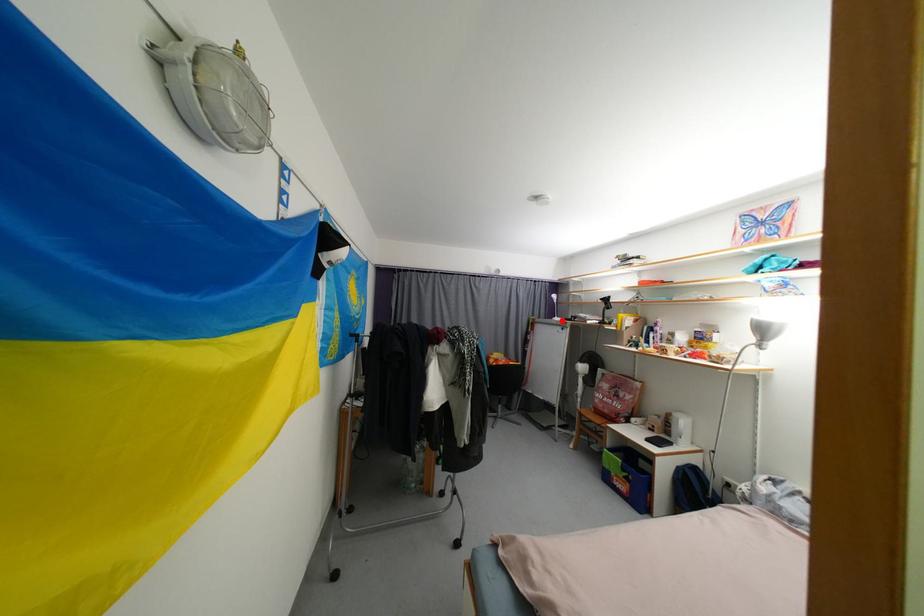
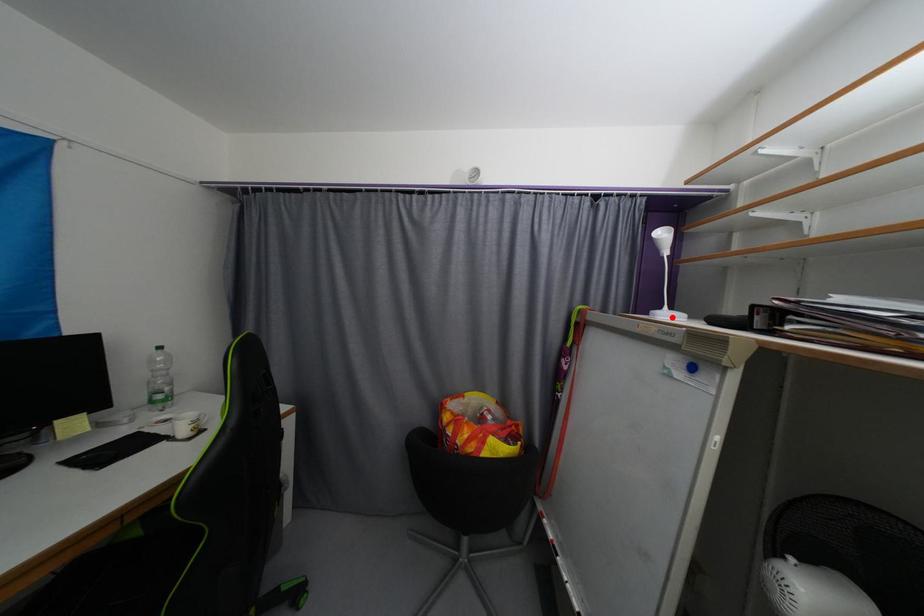
I am providing you with two images of the same scene from different viewpoints. A red point is marked on the first image and another point is marked on the second image. Does the point marked in image1 correspond to the same location as the one in image2?

Yes